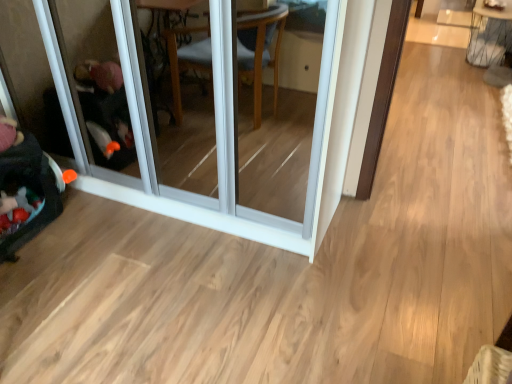
Question: From a real-world perspective, is velvet black baby carriage at left positioned above or below metallic wire table at upper right?

Choices:
 (A) above
 (B) below

Answer: (B)

Question: Is point (47, 162) positioned closer to the camera than point (492, 64)?

Choices:
 (A) farther
 (B) closer

Answer: (B)

Question: Estimate the real-world distances between objects in this image. Which object is farther from the metallic wire table at upper right?

Choices:
 (A) velvet black baby carriage at left
 (B) transparent glass screen door at left

Answer: (A)

Question: Which object is the farthest from the transparent glass screen door at left?

Choices:
 (A) velvet black baby carriage at left
 (B) metallic wire table at upper right

Answer: (B)